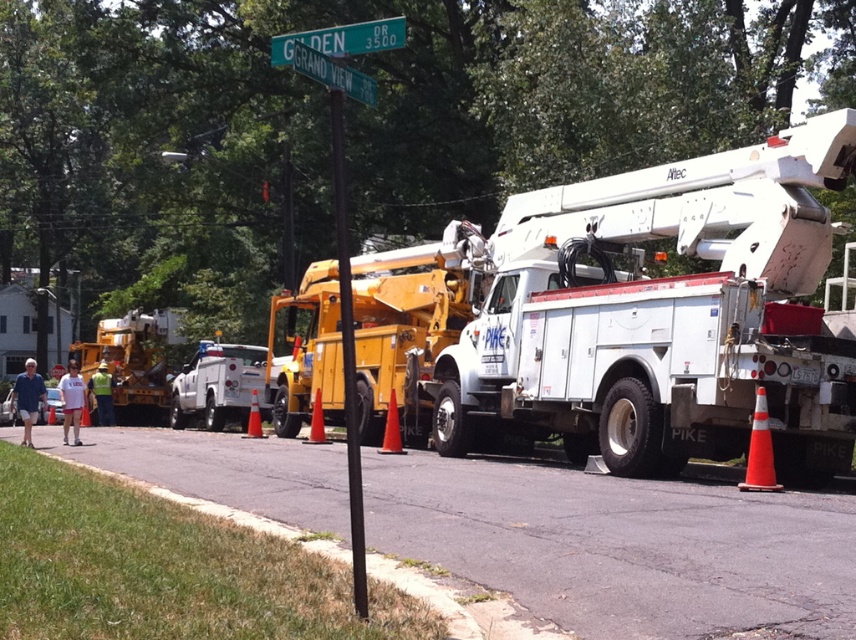
Which is more to the left, yellow metallic utility truck at center or orange plastic traffic cone at center?

From the viewer's perspective, orange plastic traffic cone at center appears more on the left side.

Which of these two, yellow metallic utility truck at center or orange plastic traffic cone at center, stands taller?

yellow metallic utility truck at center is taller.

Does point (468, 248) come farther from viewer compared to point (314, 397)?

No, it is not.

Where is `yellow metallic utility truck at center`? This screenshot has width=856, height=640. yellow metallic utility truck at center is located at coordinates (409, 321).

Is yellow metallic utility truck at center further to the viewer compared to black metal pole at center?

Yes, yellow metallic utility truck at center is behind black metal pole at center.

Is yellow metallic utility truck at center to the right of black metal pole at center from the viewer's perspective?

Indeed, yellow metallic utility truck at center is positioned on the right side of black metal pole at center.

Locate an element on the screen. yellow metallic utility truck at center is located at coordinates (409, 321).

Where is `white metallic utility truck at center`? white metallic utility truck at center is located at coordinates (664, 316).

This screenshot has width=856, height=640. What do you see at coordinates (664, 316) in the screenshot? I see `white metallic utility truck at center` at bounding box center [664, 316].

Locate an element on the screen. Image resolution: width=856 pixels, height=640 pixels. white metallic utility truck at center is located at coordinates coord(664,316).